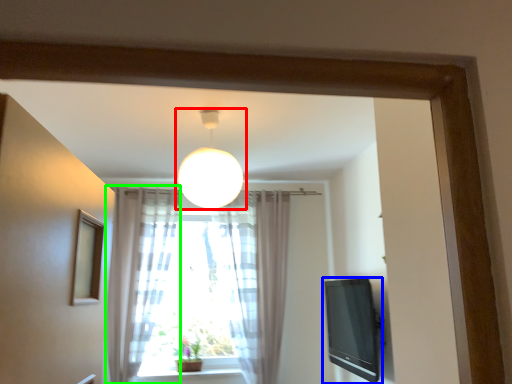
Question: Based on their relative distances, which object is farther from lamp (highlighted by a red box)? Choose from television (highlighted by a blue box) and curtain (highlighted by a green box).

Choices:
 (A) television
 (B) curtain

Answer: (A)